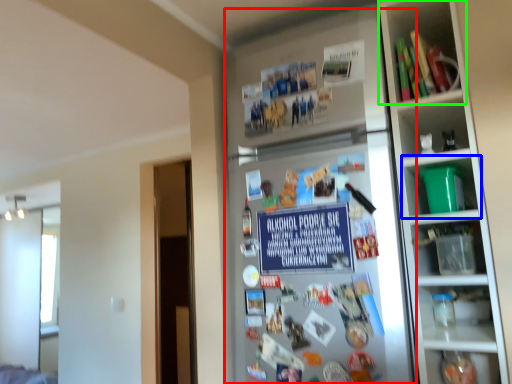
Question: Which is nearer to the fridge (highlighted by a red box)? shelf (highlighted by a blue box) or shelf (highlighted by a green box).

Choices:
 (A) shelf
 (B) shelf

Answer: (A)